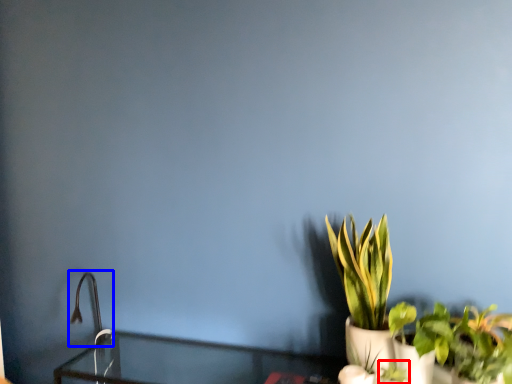
Question: Which of the following is the closest to the observer, plant (highlighted by a red box) or faucet (highlighted by a blue box)?

Choices:
 (A) plant
 (B) faucet

Answer: (A)